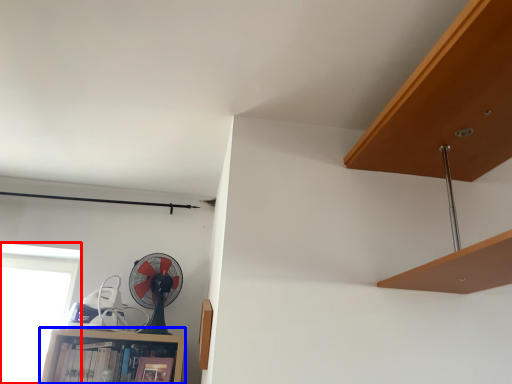
Question: Among these objects, which one is farthest to the camera, window (highlighted by a red box) or cabinet (highlighted by a blue box)?

Choices:
 (A) window
 (B) cabinet

Answer: (A)